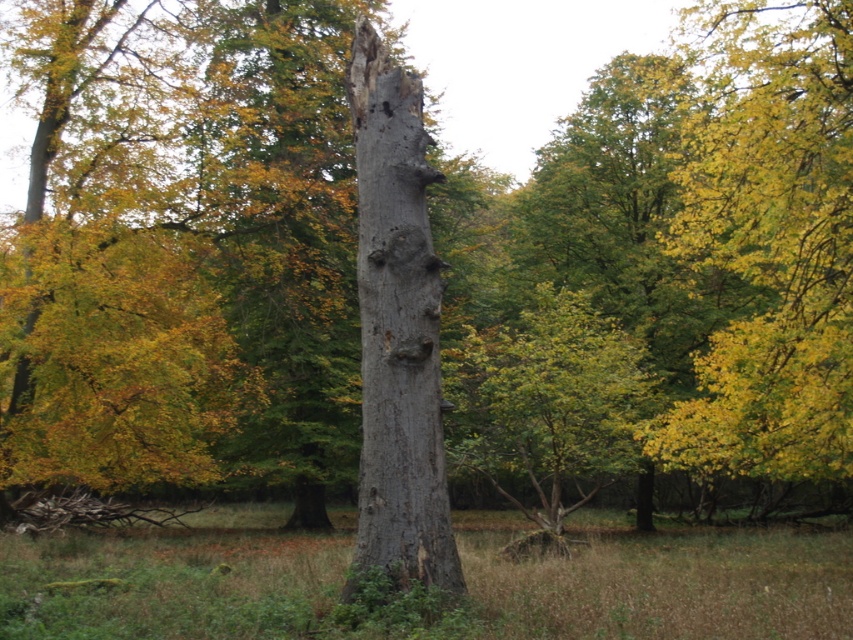
Who is shorter, gray rough bark tree trunk at center or smooth gray bark at center?

gray rough bark tree trunk at center is shorter.

Does point (418, 561) come in front of point (563, 387)?

Yes.

Who is more forward, (440, 465) or (474, 355)?

Point (440, 465) is in front.

Locate an element on the screen. Image resolution: width=853 pixels, height=640 pixels. gray rough bark tree trunk at center is located at coordinates (397, 333).

Is yellow-green leaves at upper right wider than gray rough bark tree trunk at center?

Correct, the width of yellow-green leaves at upper right exceeds that of gray rough bark tree trunk at center.

Does yellow-green leaves at upper right appear on the right side of gray rough bark tree trunk at center?

Yes, yellow-green leaves at upper right is to the right of gray rough bark tree trunk at center.

Does point (782, 275) lie behind point (372, 433)?

Yes.

Where is `yellow-green leaves at upper right`? The height and width of the screenshot is (640, 853). yellow-green leaves at upper right is located at coordinates (770, 246).

Which is more to the right, yellow-green leaves at upper right or smooth gray bark at center?

yellow-green leaves at upper right

Does point (795, 152) come behind point (549, 456)?

No.

You are a GUI agent. You are given a task and a screenshot of the screen. Output one action in this format:
    pyautogui.click(x=<x>, y=<y>)
    Task: Click on the yellow-green leaves at upper right
    The width and height of the screenshot is (853, 640).
    Given the screenshot: What is the action you would take?
    pyautogui.click(x=770, y=246)